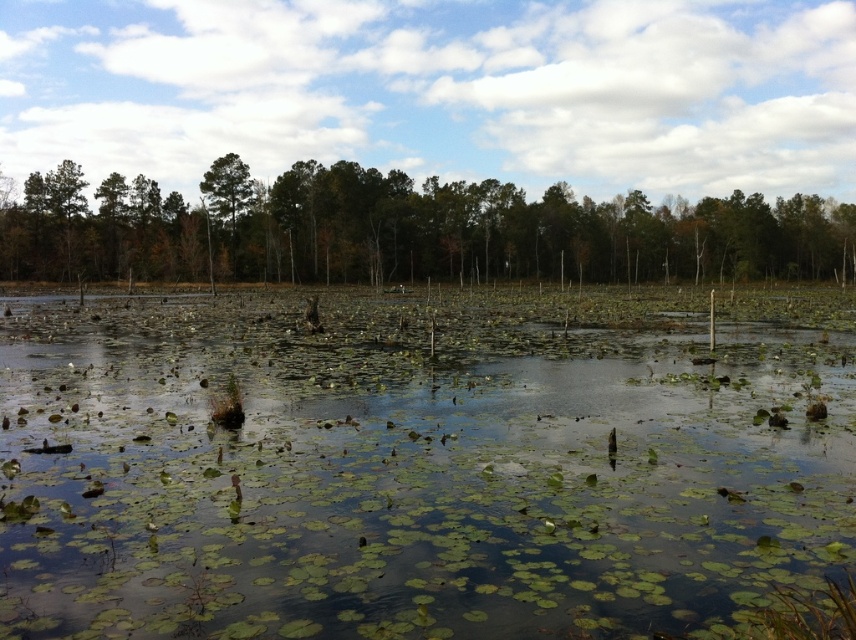
Does point (649, 323) come behind point (25, 269)?

That is False.

Is green leafy water at center closer to the viewer compared to green leafy trees at center?

Yes, it is.

Where is `green leafy water at center`? green leafy water at center is located at coordinates (414, 467).